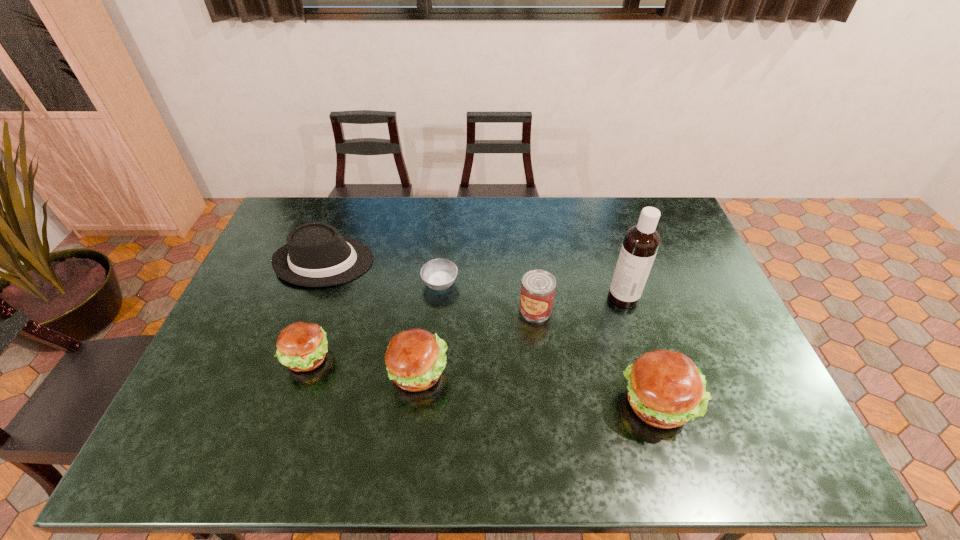
To achieve even spacing by inserting another hamburger among them, please point to a vacant spot for this new hamburger. Please provide its 2D coordinates. Your answer should be formatted as a tuple, i.e. [(x, y)], where the tuple contains the x and y coordinates of a point satisfying the conditions above.

[(535, 387)]